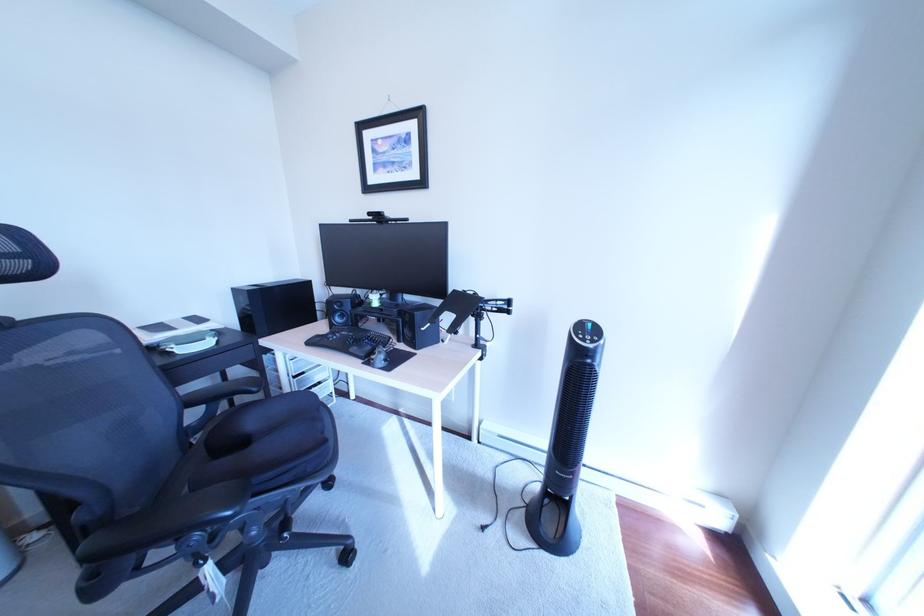
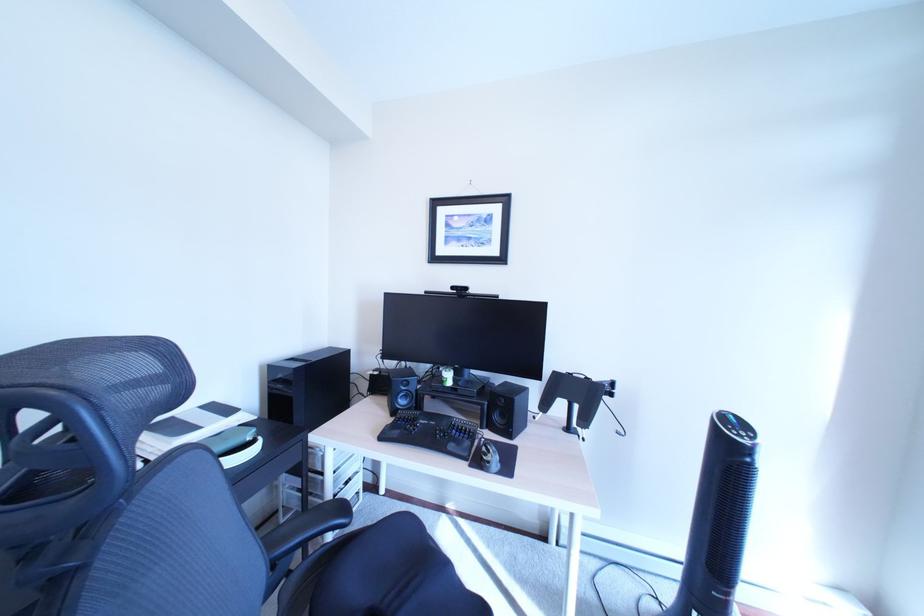
Question: How did the camera likely rotate?

Choices:
 (A) Left
 (B) Right
 (C) Up
 (D) Down

Answer: (C)